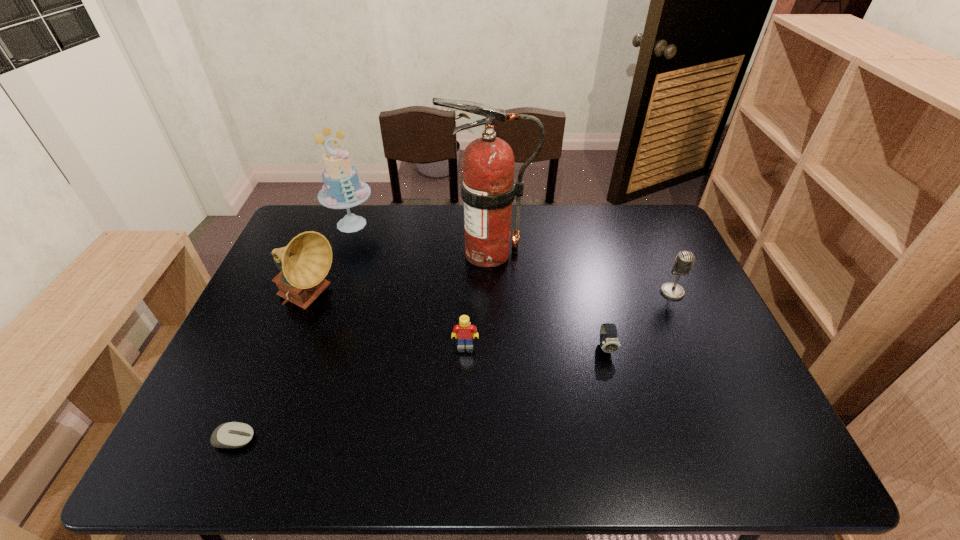
Find the location of a particular element. The width and height of the screenshot is (960, 540). free space at the left edge is located at coordinates (252, 321).

This screenshot has height=540, width=960. I want to click on vacant space at the right edge of the desktop, so click(x=656, y=307).

At what (x,y) coordinates should I click in order to perform the action: click on vacant space at the far left corner of the desktop. Please return your answer as a coordinate pair (x, y). Looking at the image, I should click on (295, 227).

At what (x,y) coordinates should I click in order to perform the action: click on vacant space in between the second object from right to left and the rightmost object. Please return your answer as a coordinate pair (x, y). The image size is (960, 540). Looking at the image, I should click on (639, 320).

At what (x,y) coordinates should I click in order to perform the action: click on free space between the microphone and the computer equipment. Please return your answer as a coordinate pair (x, y). This screenshot has width=960, height=540. Looking at the image, I should click on (453, 366).

The width and height of the screenshot is (960, 540). Identify the location of vacant space that is in between the Lego and the microphone. (568, 319).

At what (x,y) coordinates should I click in order to perform the action: click on free space between the tallest object and the third shortest object. Please return your answer as a coordinate pair (x, y). Looking at the image, I should click on (477, 299).

Where is `free space between the fire extinguisher and the Lego`? Image resolution: width=960 pixels, height=540 pixels. free space between the fire extinguisher and the Lego is located at coordinates (477, 299).

At what (x,y) coordinates should I click in order to perform the action: click on free spot between the third shortest object and the cake. Please return your answer as a coordinate pair (x, y). Looking at the image, I should click on (409, 285).

I want to click on vacant space in between the tallest object and the second shortest object, so click(547, 300).